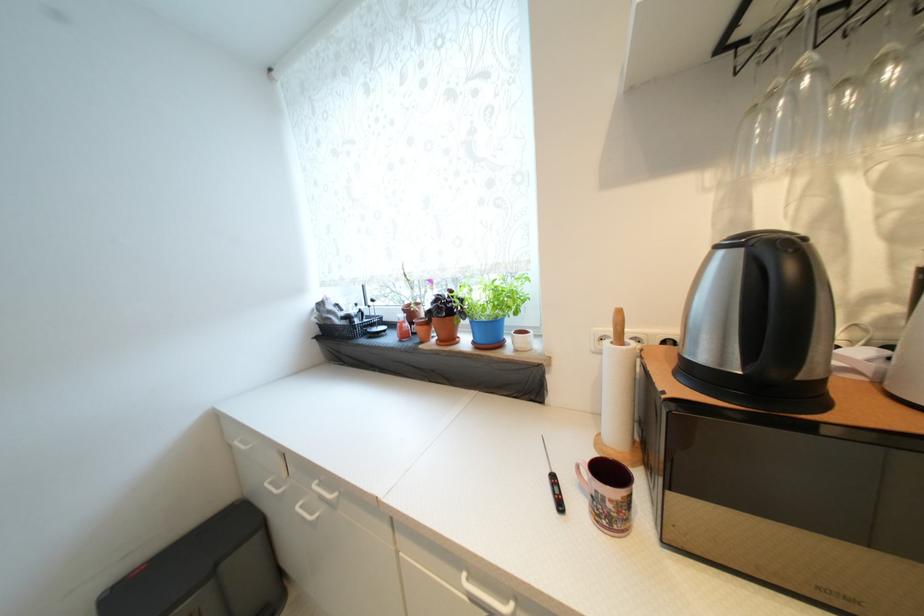
Find where to press the kettle lid button. Please return your answer as a coordinate pair (x, y).

(776, 288)